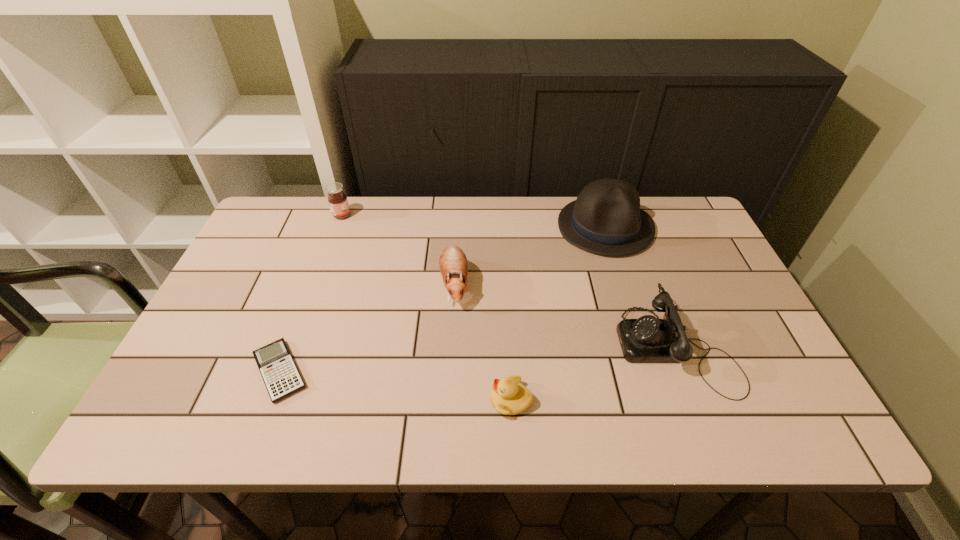
Find the location of a particular element. This screenshot has width=960, height=540. duckling positioned at the near edge is located at coordinates (508, 396).

Identify the location of calculator that is at the near edge. (279, 372).

You are a GUI agent. You are given a task and a screenshot of the screen. Output one action in this format:
    pyautogui.click(x=<x>, y=<y>)
    Task: Click on the object that is at the left edge
    The height and width of the screenshot is (540, 960).
    Given the screenshot: What is the action you would take?
    pyautogui.click(x=279, y=372)

Locate an element on the screen. The image size is (960, 540). bowler hat present at the right edge is located at coordinates (606, 219).

Locate an element on the screen. The height and width of the screenshot is (540, 960). telephone present at the right edge is located at coordinates (648, 339).

Image resolution: width=960 pixels, height=540 pixels. I want to click on object that is positioned at the near left corner, so coord(279,372).

This screenshot has height=540, width=960. I want to click on object that is at the far right corner, so click(x=606, y=219).

This screenshot has width=960, height=540. In order to click on object that is positioned at the near right corner in this screenshot , I will do `click(648, 339)`.

Locate an element on the screen. Image resolution: width=960 pixels, height=540 pixels. free spot at the far edge of the desktop is located at coordinates (485, 217).

This screenshot has height=540, width=960. What are the coordinates of `vacant space at the near edge` in the screenshot? It's located at (272, 434).